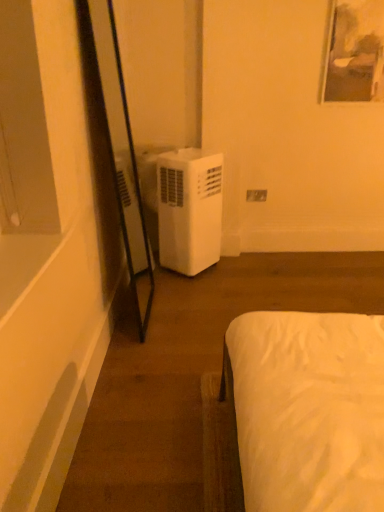
Describe the element at coordinates (189, 210) in the screenshot. The image size is (384, 512). I see `white plastic air conditioner at left` at that location.

You are a GUI agent. You are given a task and a screenshot of the screen. Output one action in this format:
    pyautogui.click(x=<x>, y=<y>)
    Task: Click on the white plastic air conditioner at left
    The image size is (384, 512).
    Given the screenshot: What is the action you would take?
    pyautogui.click(x=189, y=210)

The width and height of the screenshot is (384, 512). Describe the element at coordinates (256, 195) in the screenshot. I see `white plastic electric outlet at center` at that location.

You are a GUI agent. You are given a task and a screenshot of the screen. Output one action in this format:
    pyautogui.click(x=<x>, y=<y>)
    Task: Click on the white plastic electric outlet at center
    
    Given the screenshot: What is the action you would take?
    pyautogui.click(x=256, y=195)

You are a GUI agent. You are given a task and a screenshot of the screen. Output one action in this format:
    pyautogui.click(x=<x>, y=<y>)
    Task: Click on the white plastic air conditioner at left
    
    Given the screenshot: What is the action you would take?
    pyautogui.click(x=189, y=210)

Does white plastic air conditioner at left appear on the right side of white plastic electric outlet at center?

In fact, white plastic air conditioner at left is to the left of white plastic electric outlet at center.

Between white plastic air conditioner at left and white plastic electric outlet at center, which one is positioned in front?

white plastic air conditioner at left is more forward.

Considering the points (211, 199) and (250, 199), which point is behind, point (211, 199) or point (250, 199)?

Point (250, 199)

From the image's perspective, who appears lower, white plastic air conditioner at left or white plastic electric outlet at center?

white plastic air conditioner at left appears lower in the image.

From a real-world perspective, which object stands above the other?

white plastic electric outlet at center is physically above.

Can you confirm if white plastic air conditioner at left is wider than white plastic electric outlet at center?

Indeed, white plastic air conditioner at left has a greater width compared to white plastic electric outlet at center.

Looking at this image, considering the relative sizes of white plastic air conditioner at left and white plastic electric outlet at center in the image provided, is white plastic air conditioner at left shorter than white plastic electric outlet at center?

In fact, white plastic air conditioner at left may be taller than white plastic electric outlet at center.

Can you confirm if white plastic air conditioner at left is bigger than white plastic electric outlet at center?

Yes.

Is white plastic electric outlet at center surrounded by white plastic air conditioner at left?

That's incorrect, white plastic electric outlet at center is not inside white plastic air conditioner at left.

Based on the photo, is white plastic air conditioner at left not close to white plastic electric outlet at center?

white plastic air conditioner at left is near white plastic electric outlet at center, not far away.

Could you tell me if white plastic air conditioner at left is facing white plastic electric outlet at center?

No, white plastic air conditioner at left does not turn towards white plastic electric outlet at center.

Find the location of `air conditioner to the left of white plastic electric outlet at center`. air conditioner to the left of white plastic electric outlet at center is located at coordinates (189, 210).

Which is more to the right, white plastic electric outlet at center or white plastic air conditioner at left?

From the viewer's perspective, white plastic electric outlet at center appears more on the right side.

Considering the positions of objects white plastic electric outlet at center and white plastic air conditioner at left in the image provided, who is in front, white plastic electric outlet at center or white plastic air conditioner at left?

white plastic air conditioner at left is in front.

Between point (255, 201) and point (193, 263), which one is positioned behind?

The point (255, 201) is farther.

From the image's perspective, which is below, white plastic electric outlet at center or white plastic air conditioner at left?

white plastic air conditioner at left, from the image's perspective.

From a real-world perspective, which is physically above, white plastic electric outlet at center or white plastic air conditioner at left?

white plastic electric outlet at center is physically above.

Does white plastic electric outlet at center have a lesser width compared to white plastic air conditioner at left?

Yes, white plastic electric outlet at center is thinner than white plastic air conditioner at left.

Which of these two, white plastic electric outlet at center or white plastic air conditioner at left, stands taller?

white plastic air conditioner at left is taller.

Based on their sizes in the image, would you say white plastic electric outlet at center is bigger or smaller than white plastic air conditioner at left?

white plastic electric outlet at center is smaller than white plastic air conditioner at left.

Do you think white plastic electric outlet at center is within white plastic air conditioner at left, or outside of it?

white plastic electric outlet at center is not inside white plastic air conditioner at left, it's outside.

Is there a large distance between white plastic electric outlet at center and white plastic air conditioner at left?

white plastic electric outlet at center is near white plastic air conditioner at left, not far away.

Could you tell me if white plastic electric outlet at center is facing white plastic air conditioner at left?

No, white plastic electric outlet at center is not aimed at white plastic air conditioner at left.

How many degrees apart are the facing directions of white plastic electric outlet at center and white plastic air conditioner at left?

They differ by 1.27 degrees in their facing directions.

How far apart are white plastic electric outlet at center and white plastic air conditioner at left?

A distance of 24.40 inches exists between white plastic electric outlet at center and white plastic air conditioner at left.

I want to click on electric outlet that is behind the white plastic air conditioner at left, so click(256, 195).

Identify the location of electric outlet behind the white plastic air conditioner at left. The image size is (384, 512). (256, 195).

The height and width of the screenshot is (512, 384). What are the coordinates of `electric outlet lying above the white plastic air conditioner at left (from the image's perspective)` in the screenshot? It's located at (256, 195).